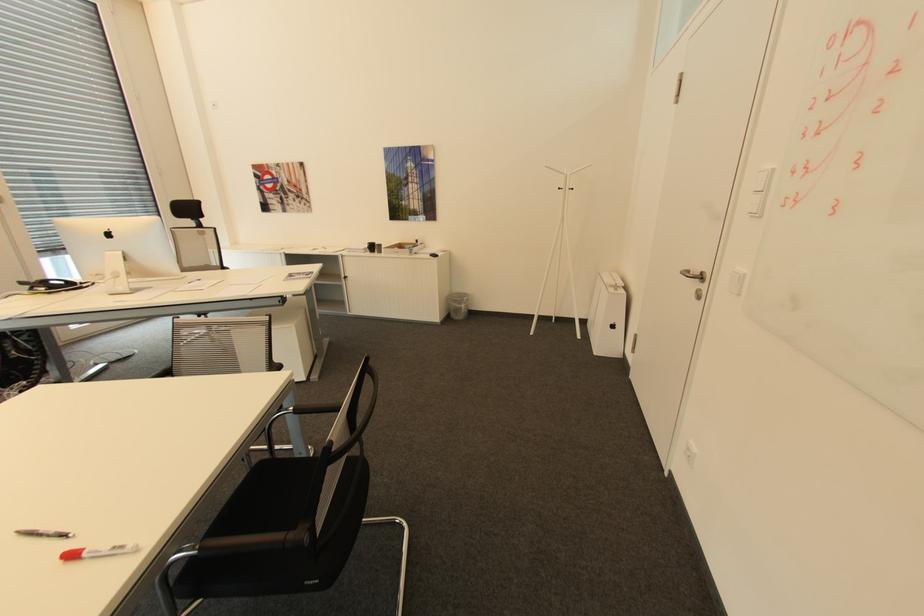
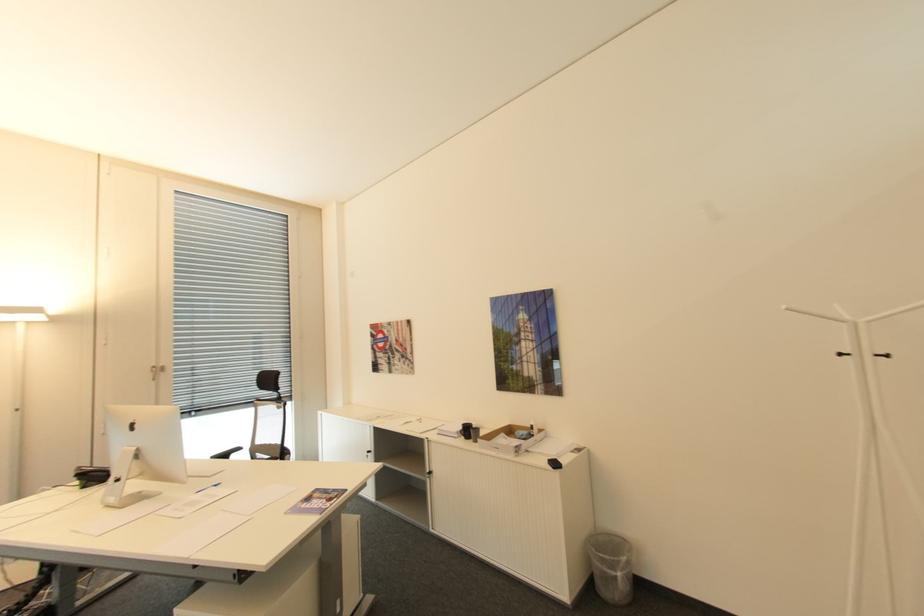
The point at (117, 233) is marked in the first image. Where is the corresponding point in the second image?

(140, 426)